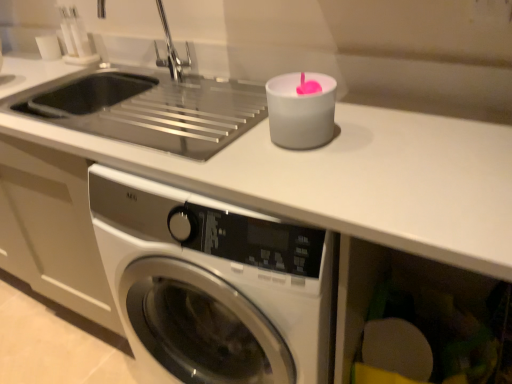
Locate an element on the screen. free space that is to the left of white matte candle at upper right is located at coordinates (232, 153).